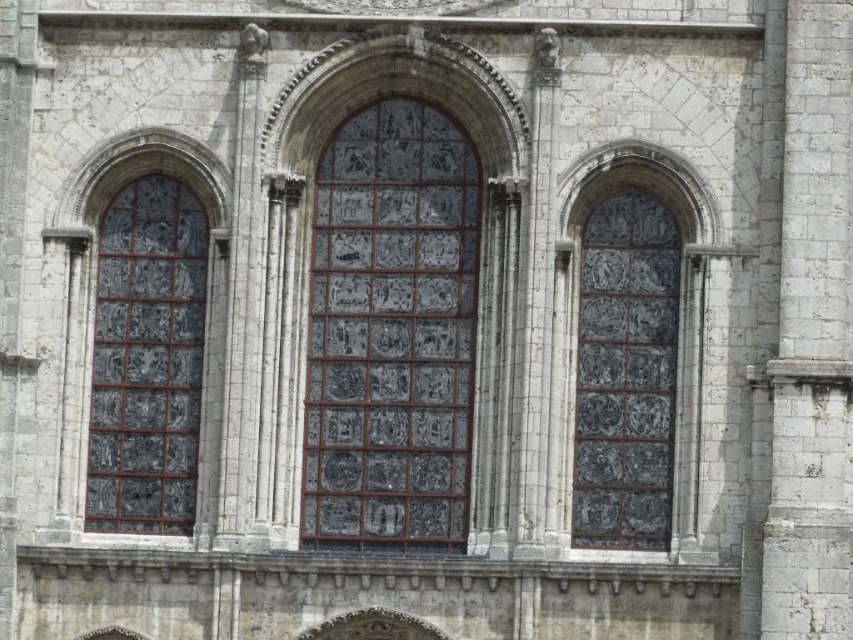
Where is `dark glass window at center`? The height and width of the screenshot is (640, 853). dark glass window at center is located at coordinates (635, 362).

Is point (616, 316) closer to viewer compared to point (111, 484)?

That is True.

Which is behind, point (587, 364) or point (172, 323)?

The point (172, 323) is more distant.

Where is `dark glass window at center`? The width and height of the screenshot is (853, 640). dark glass window at center is located at coordinates (635, 362).

Between stained glass window at center and dark glass window at center, which one appears on the left side from the viewer's perspective?

From the viewer's perspective, stained glass window at center appears more on the left side.

Which of these two, stained glass window at center or dark glass window at center, stands taller?

stained glass window at center is taller.

Does point (326, 339) come farther from viewer compared to point (585, 516)?

Yes, point (326, 339) is behind point (585, 516).

Image resolution: width=853 pixels, height=640 pixels. What are the coordinates of `stained glass window at center` in the screenshot? It's located at (392, 332).

Does stained glass window at center have a greater height compared to stained glass window at left?

Indeed, stained glass window at center has a greater height compared to stained glass window at left.

Which of these two, stained glass window at center or stained glass window at left, stands shorter?

stained glass window at left

Who is more forward, [386,353] or [137,186]?

Point [386,353] is in front.

Locate an element on the screen. This screenshot has height=640, width=853. stained glass window at center is located at coordinates (392, 332).